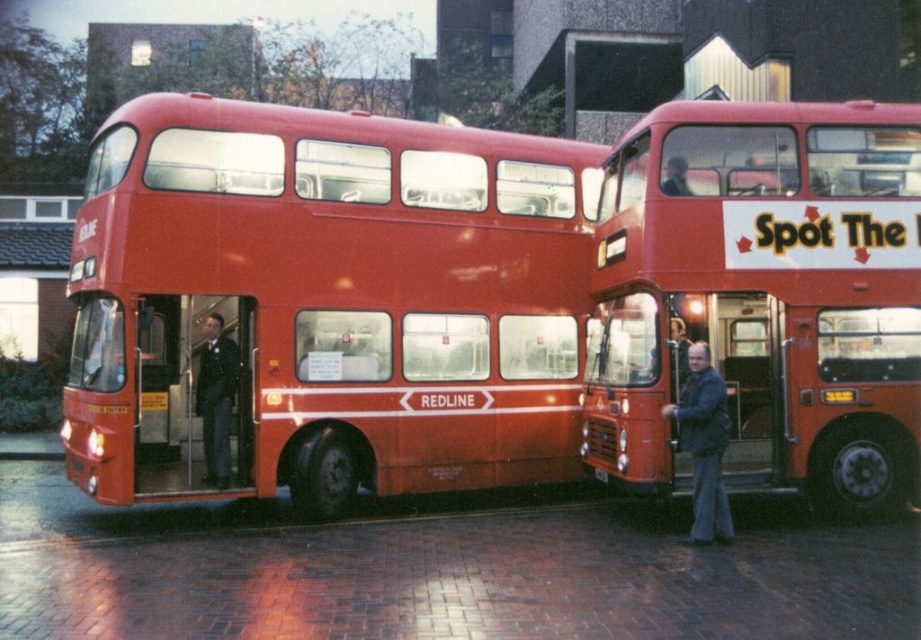
Question: Does shiny red bus at center lie in front of matte red bus at center?

Choices:
 (A) no
 (B) yes

Answer: (B)

Question: Estimate the real-world distances between objects in this image. Which object is closer to the matte red bus at center?

Choices:
 (A) dark blue suit at center
 (B) shiny red bus at center

Answer: (B)

Question: Can you confirm if dark blue suit at center is positioned to the left of black plastic license plate at center?

Choices:
 (A) yes
 (B) no

Answer: (A)

Question: Can you confirm if matte red bus at center is positioned to the left of dark blue suit at center?

Choices:
 (A) yes
 (B) no

Answer: (B)

Question: Considering the real-world distances, which object is closest to the dark blue suit at center?

Choices:
 (A) shiny red bus at center
 (B) black plastic license plate at center
 (C) dark blue jacket at right

Answer: (A)

Question: Estimate the real-world distances between objects in this image. Which object is closer to the black plastic license plate at center?

Choices:
 (A) dark blue jacket at right
 (B) shiny red bus at center
 (C) dark blue suit at center
 (D) matte red bus at center

Answer: (A)